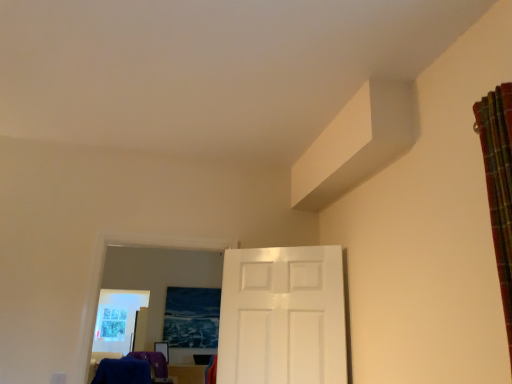
Question: Choose the correct answer: Is blue fuzzy laundry at lower left inside white glossy door at center or outside it?

Choices:
 (A) inside
 (B) outside

Answer: (B)

Question: Considering their positions, is blue fuzzy laundry at lower left located in front of or behind white glossy door at center?

Choices:
 (A) behind
 (B) front

Answer: (A)

Question: Estimate the real-world distances between objects in this image. Which object is closer to the plaid fabric curtain at right?

Choices:
 (A) white glossy door at center
 (B) blue fuzzy laundry at lower left

Answer: (A)

Question: Which object is positioned closest to the plaid fabric curtain at right?

Choices:
 (A) blue fuzzy laundry at lower left
 (B) white glossy door at center

Answer: (B)